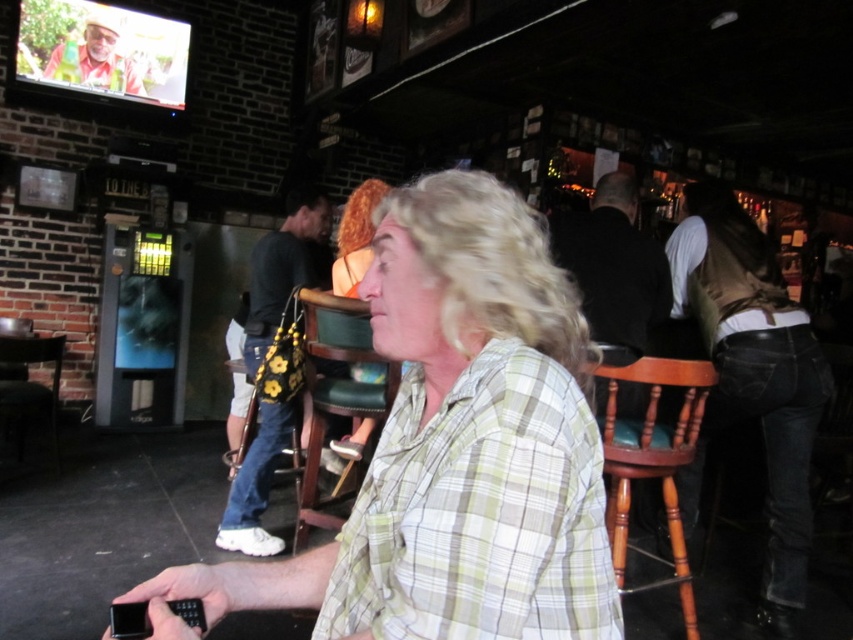
In the scene shown: You are standing in the bar and want to reach the point at coordinates (660, 296). If you can move forward 8 feet, will you be able to reach it?

The point at coordinates (660, 296) is 8.04 feet from the viewer. Since you can move forward 8 feet, you will be just short of reaching it by 0.04 feet.

You are a photographer standing in the middle of the bar. You want to take a photo of the denim jeans at right and the matte orange shirt at upper left. Which object should you focus on first to ensure both are in the frame?

You should focus on the denim jeans at right first because it is closer to you than the matte orange shirt at upper left, so by focusing on the closer object, both will be in focus.

You are a bartender at a bar. You need to deliver a drink to a customer wearing denim jeans at right and another drink to someone wearing a matte orange shirt at upper left. Which customer is farther away from you?

The denim jeans at right is 3.84 meters away from the matte orange shirt at upper left. Since the question is about distance from the bartender, but the description only provides the distance between the two customers, we cannot determine which is farther from the bartender without additional information.